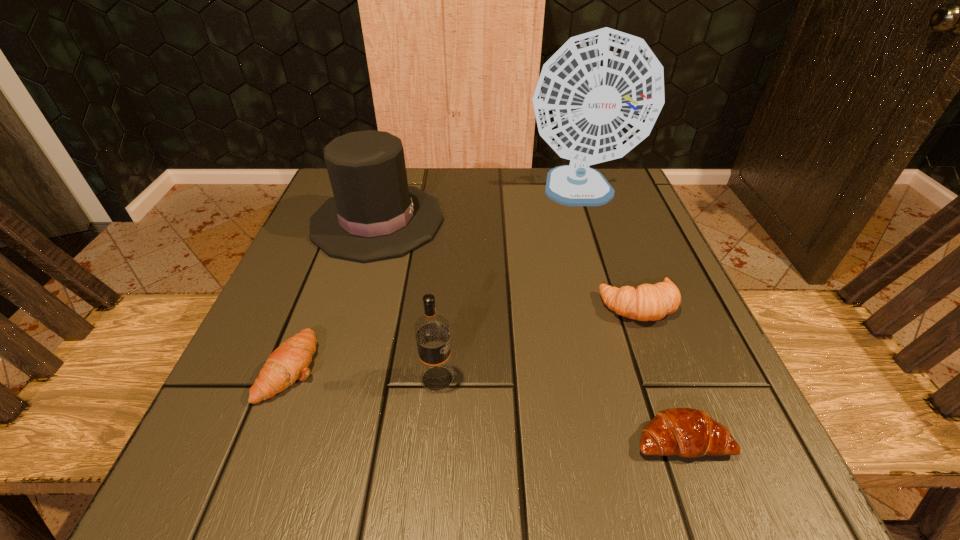
At what (x,y) coordinates should I click in order to perform the action: click on object situated at the far right corner. Please return your answer as a coordinate pair (x, y). The height and width of the screenshot is (540, 960). Looking at the image, I should click on (599, 95).

Where is `object present at the near right corner`? Image resolution: width=960 pixels, height=540 pixels. object present at the near right corner is located at coordinates (685, 432).

Where is `vacant region at the far edge of the desktop`? The height and width of the screenshot is (540, 960). vacant region at the far edge of the desktop is located at coordinates (546, 213).

You are a GUI agent. You are given a task and a screenshot of the screen. Output one action in this format:
    pyautogui.click(x=<x>, y=<y>)
    Task: Click on the free space at the near edge of the desktop
    The width and height of the screenshot is (960, 540).
    Given the screenshot: What is the action you would take?
    pyautogui.click(x=359, y=444)

This screenshot has width=960, height=540. Find the location of `vacant space at the left edge of the desktop`. vacant space at the left edge of the desktop is located at coordinates (247, 363).

In the image, there is a desktop. What are the coordinates of `vacant space at the right edge` in the screenshot? It's located at (696, 362).

Find the location of `vacant region at the far right corner of the desktop`. vacant region at the far right corner of the desktop is located at coordinates (620, 217).

In order to click on free space between the dress hat and the nearest object in this screenshot , I will do `click(529, 330)`.

The height and width of the screenshot is (540, 960). I want to click on free spot between the vodka and the leftmost crescent roll, so click(364, 373).

Identify the location of free space between the vodka and the dress hat. The image size is (960, 540). (407, 300).